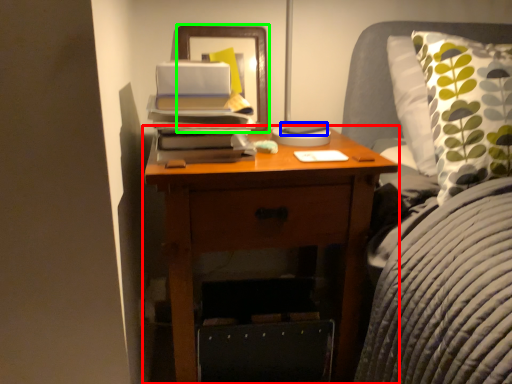
Question: Estimate the real-world distances between objects in this image. Which object is farther from nightstand (highlighted by a red box), paperback book (highlighted by a blue box) or picture frame (highlighted by a green box)?

Choices:
 (A) paperback book
 (B) picture frame

Answer: (A)